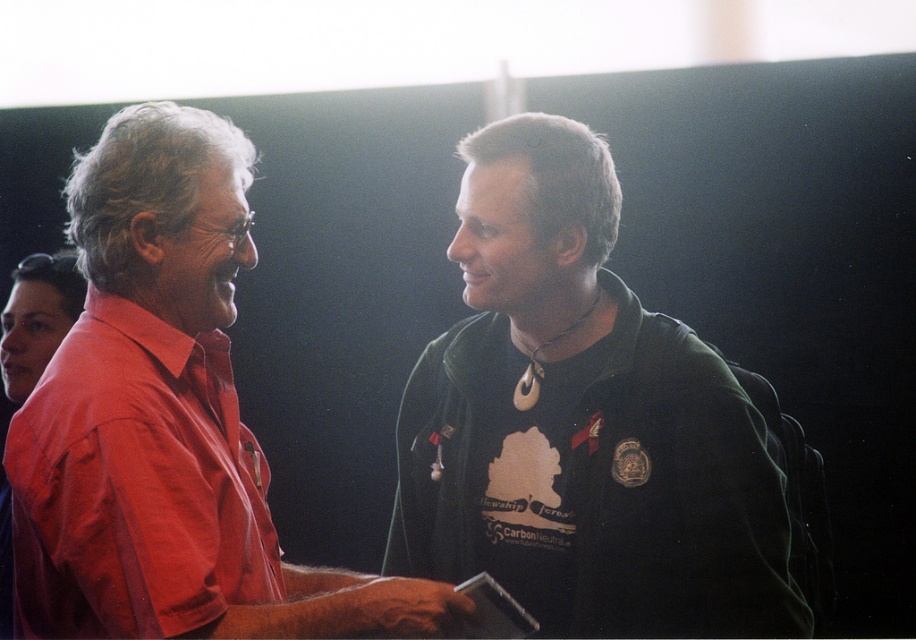
You are standing 5 feet away from the camera. There is a black matte shirt at center in the image. Can you reach it without moving?

The black matte shirt at center is 4.36 feet away from the camera. Since you are standing 5 feet away from the camera, you cannot reach it without moving closer.

You are a photographer setting up for a group photo. You need to position two subjects wearing the black matte shirt at center and the matte red shirt at left. The minimum distance required between them for proper framing is 15 inches. Based on the current setup, will they need to move closer or farther apart?

The black matte shirt at center is currently 14.56 inches from the matte red shirt at left. Since this distance is less than the required 15 inches, they need to move slightly farther apart to meet the framing requirement.